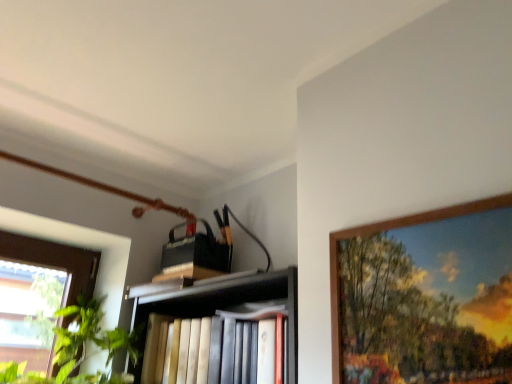
What do you see at coordinates (230, 303) in the screenshot?
I see `hardcover books at center` at bounding box center [230, 303].

The image size is (512, 384). Identify the location of hardcover books at center. (230, 303).

Where is `wooden picture frame at upper right`? wooden picture frame at upper right is located at coordinates coord(425,297).

What do you see at coordinates (425, 297) in the screenshot? This screenshot has height=384, width=512. I see `wooden picture frame at upper right` at bounding box center [425, 297].

Locate an element on the screen. hardcover books at center is located at coordinates (230, 303).

Which is more to the right, hardcover books at center or wooden picture frame at upper right?

From the viewer's perspective, wooden picture frame at upper right appears more on the right side.

Is hardcover books at center closer to the viewer compared to wooden picture frame at upper right?

No, hardcover books at center is further to the viewer.

Does point (242, 281) come behind point (406, 229)?

Yes, it is behind point (406, 229).

From the image's perspective, is hardcover books at center on top of wooden picture frame at upper right?

No, from the image's perspective, hardcover books at center is not on top of wooden picture frame at upper right.

From a real-world perspective, who is located higher, hardcover books at center or wooden picture frame at upper right?

wooden picture frame at upper right, from a real-world perspective.

Is hardcover books at center wider or thinner than wooden picture frame at upper right?

Considering their sizes, hardcover books at center looks broader than wooden picture frame at upper right.

Considering the sizes of objects hardcover books at center and wooden picture frame at upper right in the image provided, who is taller, hardcover books at center or wooden picture frame at upper right?

With more height is wooden picture frame at upper right.

Can you confirm if hardcover books at center is smaller than wooden picture frame at upper right?

Actually, hardcover books at center might be larger than wooden picture frame at upper right.

Is hardcover books at center positioned beyond the bounds of wooden picture frame at upper right?

hardcover books at center lies outside wooden picture frame at upper right's area.

Is hardcover books at center not close to wooden picture frame at upper right?

hardcover books at center is near wooden picture frame at upper right, not far away.

Is hardcover books at center facing towards wooden picture frame at upper right?

No.

How different are the orientations of hardcover books at center and wooden picture frame at upper right in degrees?

hardcover books at center and wooden picture frame at upper right are facing 5.24 degrees away from each other.

Find the location of `shelf that is under the wooden picture frame at upper right (from a real-world perspective)`. shelf that is under the wooden picture frame at upper right (from a real-world perspective) is located at coordinates (230, 303).

Is wooden picture frame at upper right to the left or to the right of hardcover books at center in the image?

Based on their positions, wooden picture frame at upper right is located to the right of hardcover books at center.

Relative to hardcover books at center, is wooden picture frame at upper right in front or behind?

wooden picture frame at upper right is in front of hardcover books at center.

Which is nearer, (460, 318) or (292, 352)?

Clearly, point (460, 318) is closer to the camera than point (292, 352).

From the image's perspective, which object appears higher, wooden picture frame at upper right or hardcover books at center?

wooden picture frame at upper right is shown above in the image.

From a real-world perspective, is wooden picture frame at upper right positioned over hardcover books at center based on gravity?

Indeed, from a real-world perspective, wooden picture frame at upper right stands above hardcover books at center.

Between wooden picture frame at upper right and hardcover books at center, which one has smaller width?

wooden picture frame at upper right is thinner.

Between wooden picture frame at upper right and hardcover books at center, which one has less height?

Standing shorter between the two is hardcover books at center.

Consider the image. Can you confirm if wooden picture frame at upper right is smaller than hardcover books at center?

Correct, wooden picture frame at upper right occupies less space than hardcover books at center.

Would you say wooden picture frame at upper right contains hardcover books at center?

No, hardcover books at center is not surrounded by wooden picture frame at upper right.

Is wooden picture frame at upper right positioned far away from hardcover books at center?

No, wooden picture frame at upper right is not far from hardcover books at center.

Is wooden picture frame at upper right looking in the opposite direction of hardcover books at center?

No, wooden picture frame at upper right's orientation is not away from hardcover books at center.

How many degrees apart are the facing directions of wooden picture frame at upper right and hardcover books at center?

There is a 5.24-degree angle between the facing directions of wooden picture frame at upper right and hardcover books at center.

Locate an element on the screen. Image resolution: width=512 pixels, height=384 pixels. shelf on the left of wooden picture frame at upper right is located at coordinates [x=230, y=303].

The width and height of the screenshot is (512, 384). What are the coordinates of `shelf on the left of the wooden picture frame at upper right` in the screenshot? It's located at (230, 303).

Locate an element on the screen. picture frame in front of the hardcover books at center is located at coordinates (425, 297).